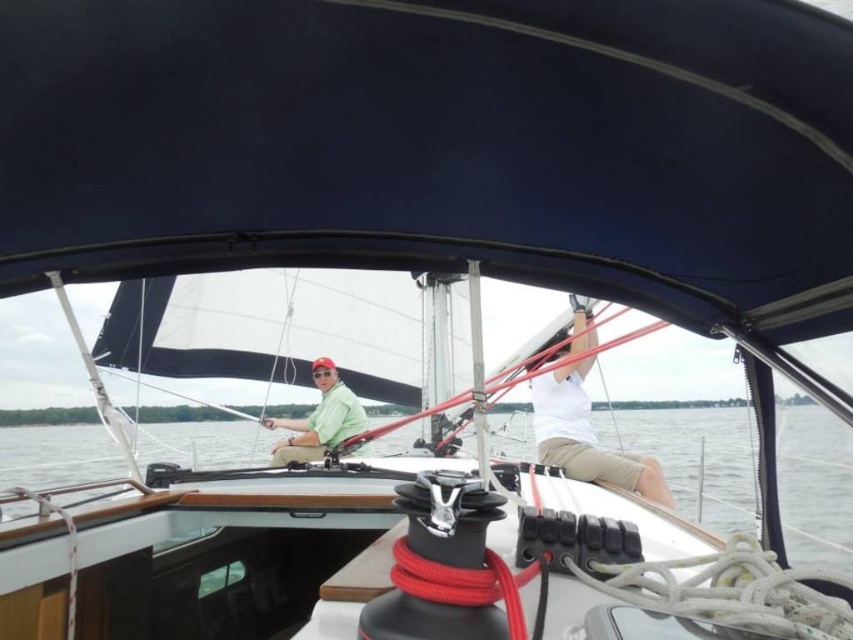
You are navigating a sailboat and need to adjust the ropes. There are two points marked on the boat deck at coordinates point (x=844, y=492) and point (x=341, y=436). Which point is closer to the front of the boat?

Result: Point (x=844, y=492) is in front of point (x=341, y=436), so it is closer to the front of the boat.

Consider the image. You are a sailor on the boat and need to determine which object occupies more space in the current view. Which one is larger between the clear water at center and the matte green shirt at center?

The clear water at center is larger in size than the matte green shirt at center, so the clear water at center occupies more space in the current view.